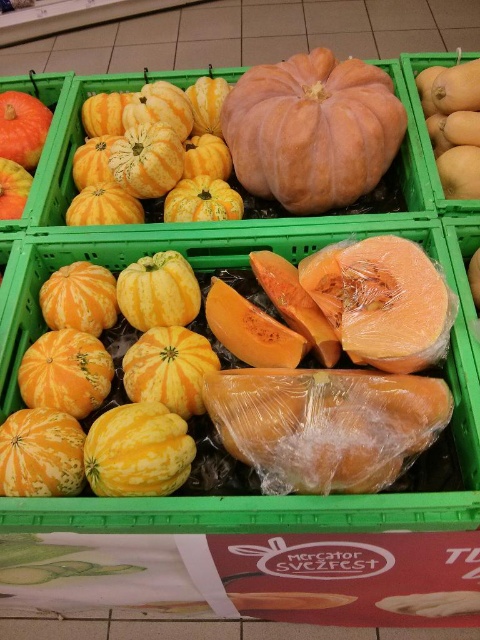
Question: Based on their relative distances, which object is farther from the yellow-orange smooth pumpkin at center-left?

Choices:
 (A) translucent plastic cantaloupe at center
 (B) orange matte pumpkin at upper left
 (C) orange matte pumpkin at center

Answer: (B)

Question: Where is yellow matte pumpkin at center located in relation to orange matte pumpkin at upper left in the image?

Choices:
 (A) below
 (B) above

Answer: (A)

Question: Does translucent plastic cantaloupe at center appear on the left side of yellow-orange smooth pumpkin at center-left?

Choices:
 (A) no
 (B) yes

Answer: (A)

Question: Can you confirm if orange matte pumpkin at center is bigger than orange matte pumpkin at upper left?

Choices:
 (A) no
 (B) yes

Answer: (B)

Question: Which point is closer to the camera taking this photo?

Choices:
 (A) (9, 216)
 (B) (175, 355)

Answer: (B)

Question: Estimate the real-world distances between objects in this image. Which object is closer to the translucent plastic cantaloupe at center?

Choices:
 (A) yellow matte pumpkin at center
 (B) orange matte pumpkin at upper left
 (C) yellow-orange smooth pumpkin at center-left

Answer: (A)